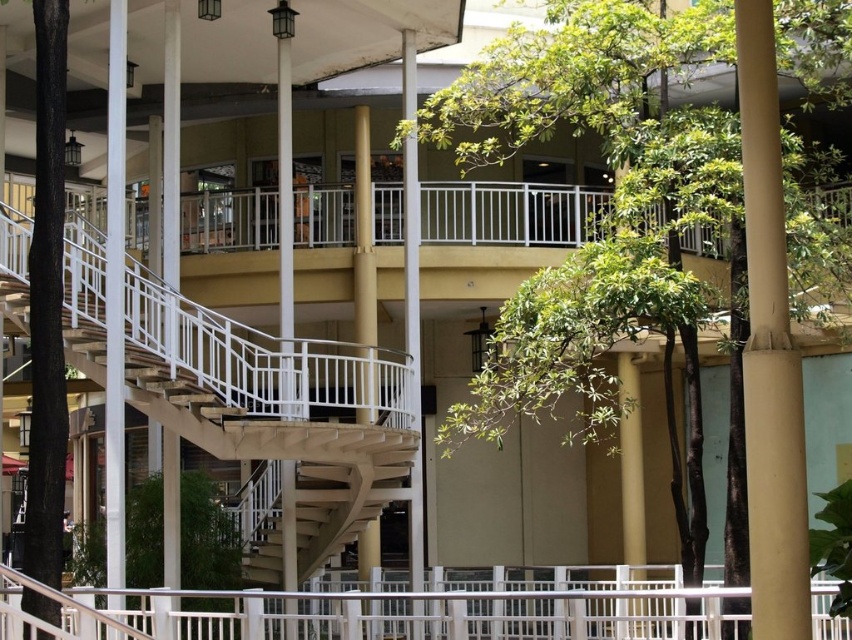
You are an interior designer assessing the space between the white metal railing at center and the tan smooth pole at right. Given that the railing is larger, which object would you recommend placing a decorative plant pot next to for better visual balance?

The tan smooth pole at right would be the better choice to place the decorative plant pot next to, as it is smaller than the white metal railing at center, creating a balanced visual composition.

You are standing at the entrance of the building and want to take a photo of the green leafy tree at center. Based on its 2D coordinates, in which direction should you point your camera relative to your position?

The green leafy tree at center is located at coordinates approximately 0.305 on the x axis and 0.721 on the y axis. Since the entrance is at the building entrance, which is likely at the bottom of the image, pointing the camera towards the center area would capture the tree.